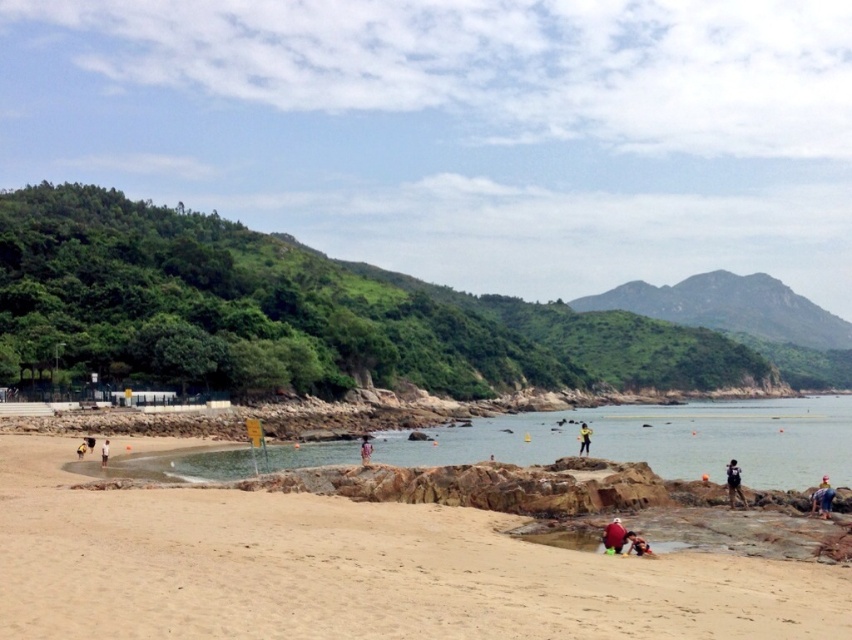
You are a photographer standing on the beach and want to take a photo of the red fabric person at center and the dark blue shirt at lower left. Which of the two subjects is shorter?

The red fabric person at center is shorter than the dark blue shirt at lower left.

You are standing on the beach and see the red fabric person at lower center and the yellow fabric person at center. Which one is nearer to you?

The red fabric person at lower center is closer to you than the yellow fabric person at center.

You are standing on the sandy beach at lower left and want to place the dark blue shirt at lower left on the ground. Considering their heights, which object is taller and would require adjusting the placement?

The sandy beach at lower left is taller than the dark blue shirt at lower left, so you would need to lower the dark blue shirt at lower left to ensure proper placement.